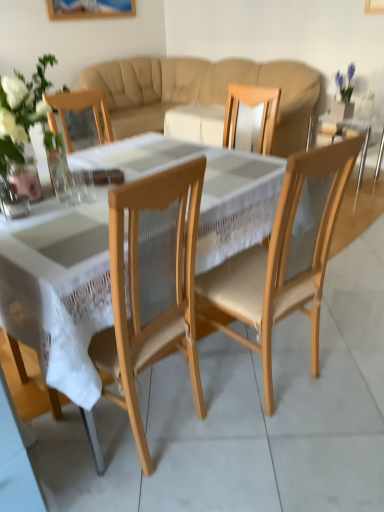
Question: Does point (77, 196) appear closer or farther from the camera than point (292, 237)?

Choices:
 (A) closer
 (B) farther

Answer: (B)

Question: Based on their positions, is clear glass at center, which is the 1th tableware from left to right, located to the left or right of natural wood chair at center?

Choices:
 (A) right
 (B) left

Answer: (B)

Question: Which of these objects is positioned closest to the natural wood chair at center?

Choices:
 (A) translucent glass vase at left
 (B) transparent glass at center, which is counted as the first tableware, starting from the right
 (C) clear glass vase at left
 (D) white lace tablecloth at center
 (E) wooden side table at right

Answer: (D)

Question: Based on their relative distances, which object is nearer to the clear glass at center, which is the 1th tableware from left to right?

Choices:
 (A) wooden side table at right
 (B) transparent glass at center, which is counted as the first tableware, starting from the right
 (C) clear glass vase at left
 (D) translucent glass vase at left
 (E) beige fabric couch at center

Answer: (B)